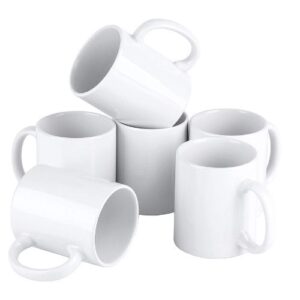
Point to all occurrences of where handle connects to side of mug in the image. Your answer should be formatted as a list of tuples, i.e. [(x1, y1), (x2, y2), ...], where each tuple contains the x and y coordinates of a point satisfying the conditions above.

[(72, 248), (29, 240), (242, 243), (242, 190), (34, 135), (267, 130), (178, 68), (135, 39)]